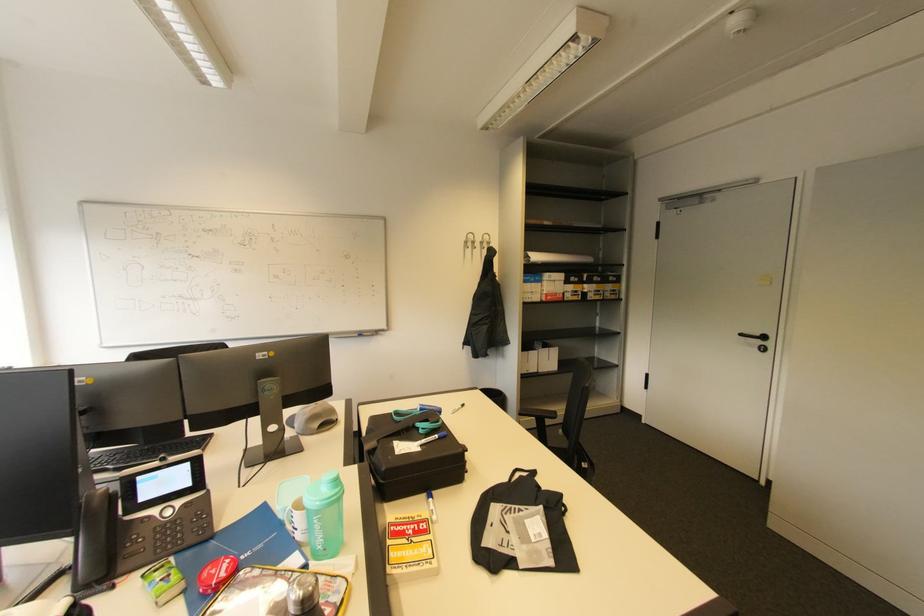
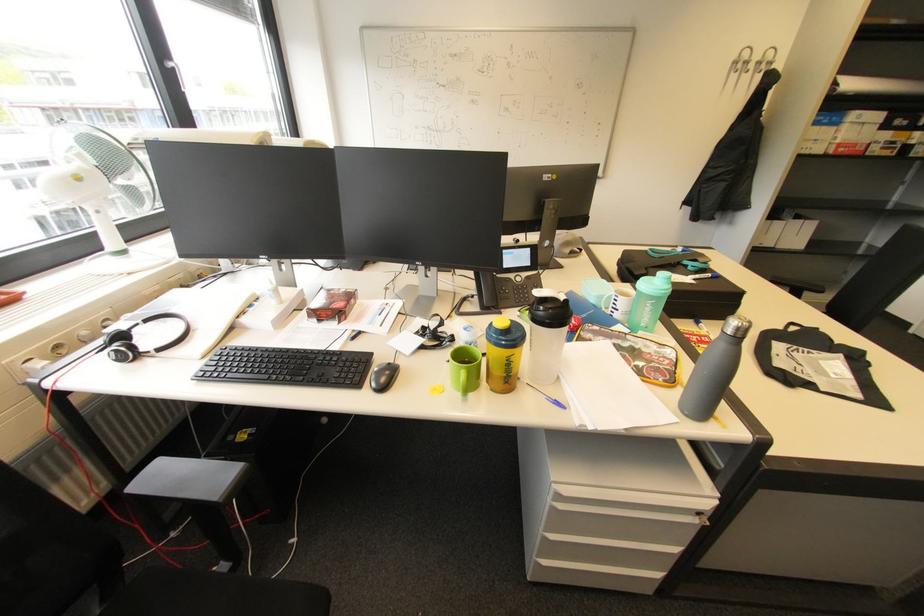
The point at (476, 237) is marked in the first image. Where is the corresponding point in the second image?

(751, 54)